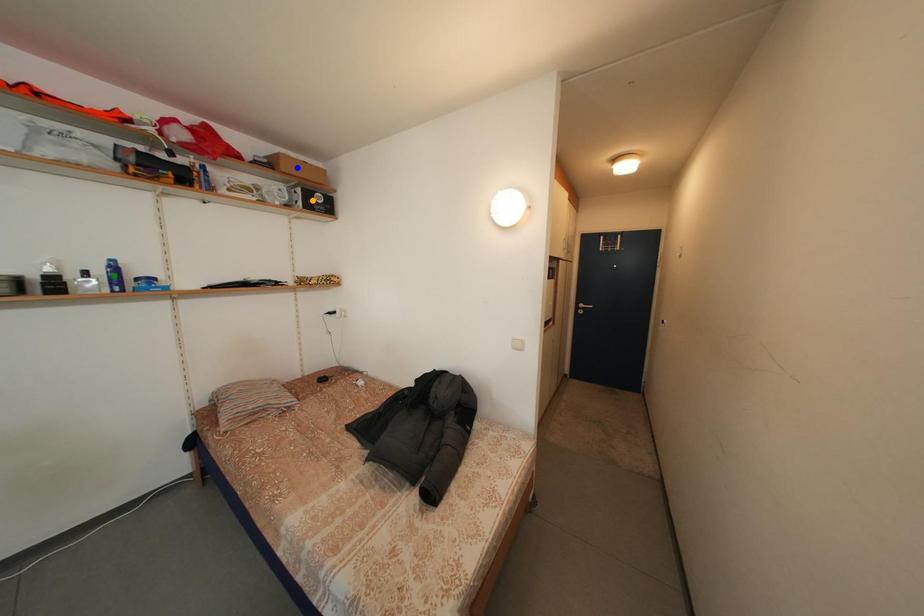
Order these from nearest to farthest:
green point | orange point | blue point

green point
blue point
orange point